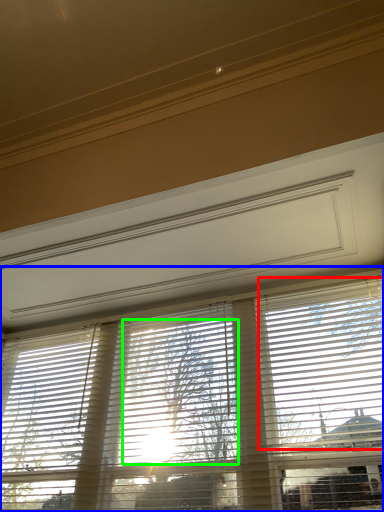
Question: Which object is the farthest from blind (highlighted by a red box)? Choose among these: window blind (highlighted by a blue box) or tree (highlighted by a green box).

Choices:
 (A) window blind
 (B) tree

Answer: (B)